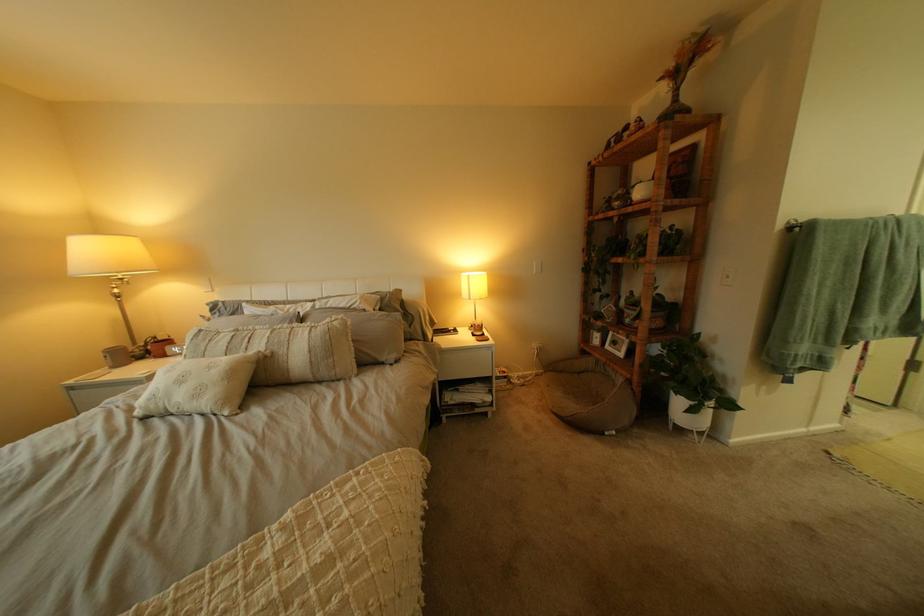
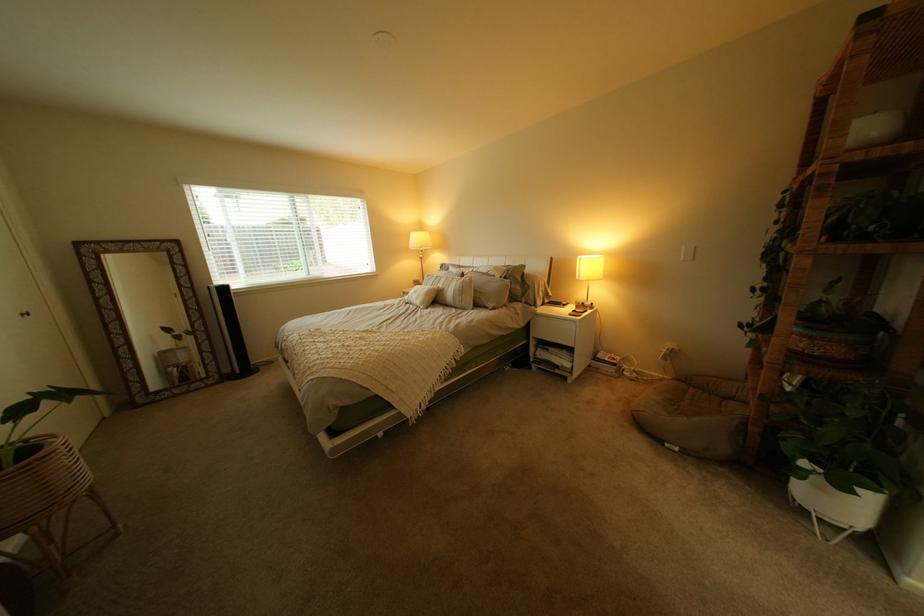
Locate, in the second image, the point that corresponds to the point at 697,432 in the first image.

(821, 512)